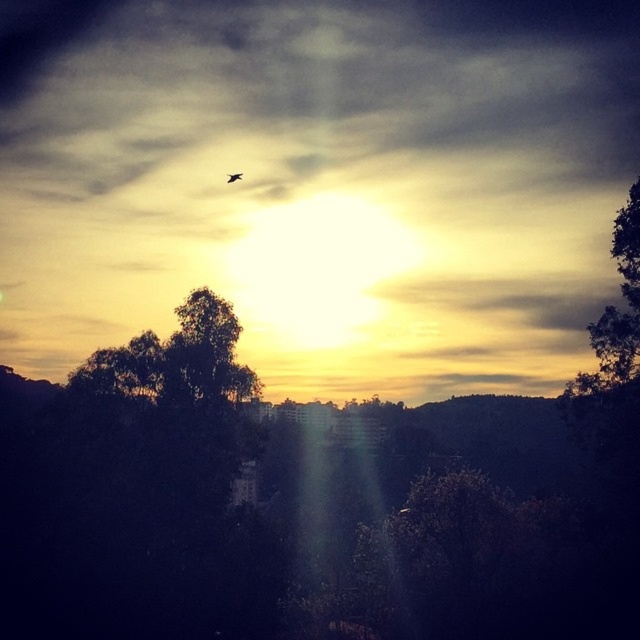
You are an architect designing a new observatory. You want to place a telescope in the observatory such that it can view both the smokey gray cloud at upper center and the transparent glass plane at upper center simultaneously. Given that the telescope has a field of view of 15 meters, can it capture both objects in one view?

The smokey gray cloud at upper center is 16.33 meters away from the transparent glass plane at upper center. Since the distance between them exceeds the telescope field of view of 15 meters, the telescope cannot capture both objects in one view.

You are standing at the center of the image. Which direction should you move to reach the green leafy tree at center?

The green leafy tree at center is located at point coordinates of (x=204, y=353). Since you are already at the center of the image, you are already positioned near the green leafy tree at center.